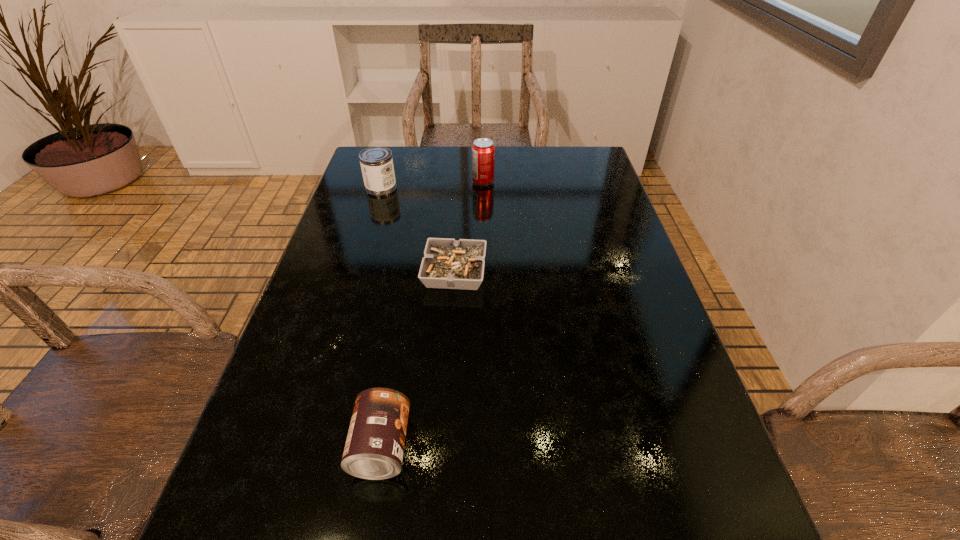
Locate an element on the screen. The image size is (960, 540). free space located 0.140m on the back of the ashtray is located at coordinates (458, 218).

Locate an element on the screen. The height and width of the screenshot is (540, 960). soda situated at the far edge is located at coordinates (483, 151).

This screenshot has height=540, width=960. Find the location of `can located at the far edge`. can located at the far edge is located at coordinates (376, 163).

The width and height of the screenshot is (960, 540). Identify the location of object that is at the left edge. (376, 163).

This screenshot has height=540, width=960. Find the location of `object that is at the far left corner`. object that is at the far left corner is located at coordinates (376, 163).

The image size is (960, 540). Identify the location of vacant space at the far edge of the desktop. (448, 172).

Find the location of `blank space at the left edge of the desktop`. blank space at the left edge of the desktop is located at coordinates (345, 256).

In the image, there is a desktop. Identify the location of free space at the right edge. Image resolution: width=960 pixels, height=540 pixels. (574, 212).

The image size is (960, 540). What are the coordinates of `blank space at the far left corner` in the screenshot? It's located at (405, 180).

I want to click on vacant space at the far right corner, so click(x=550, y=159).